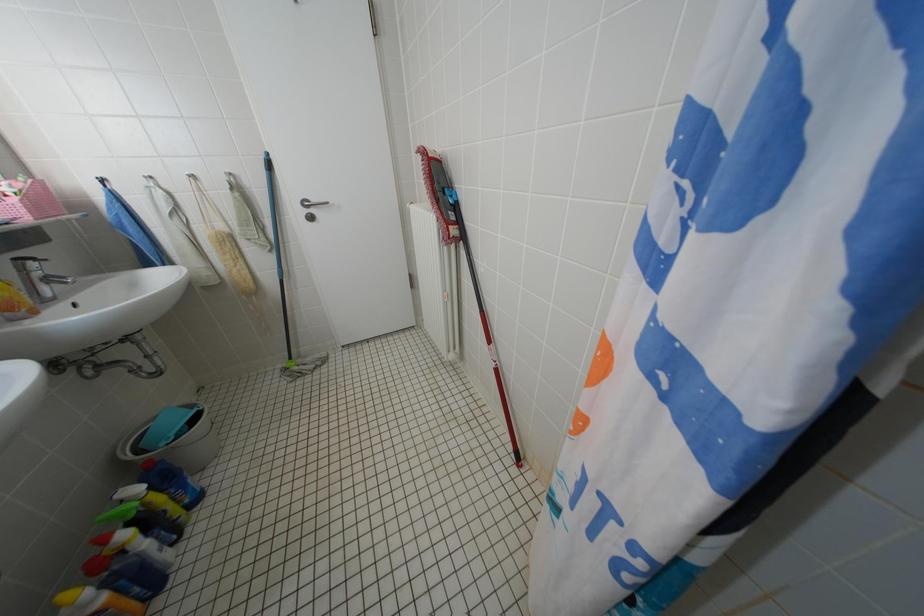
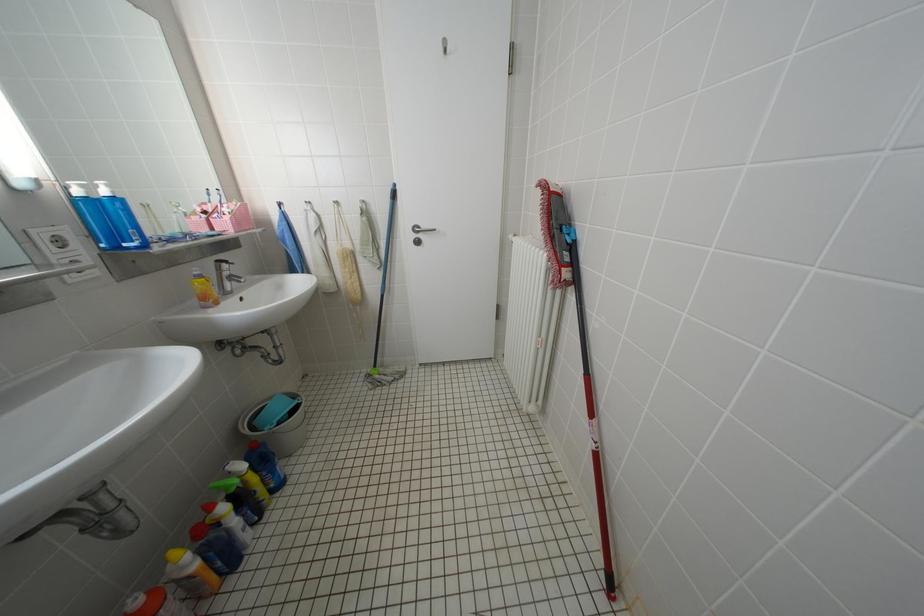
Question: The first image is from the beginning of the video and the second image is from the end. How did the camera likely rotate when shooting the video?

Choices:
 (A) Left
 (B) Right
 (C) Up
 (D) Down

Answer: (A)